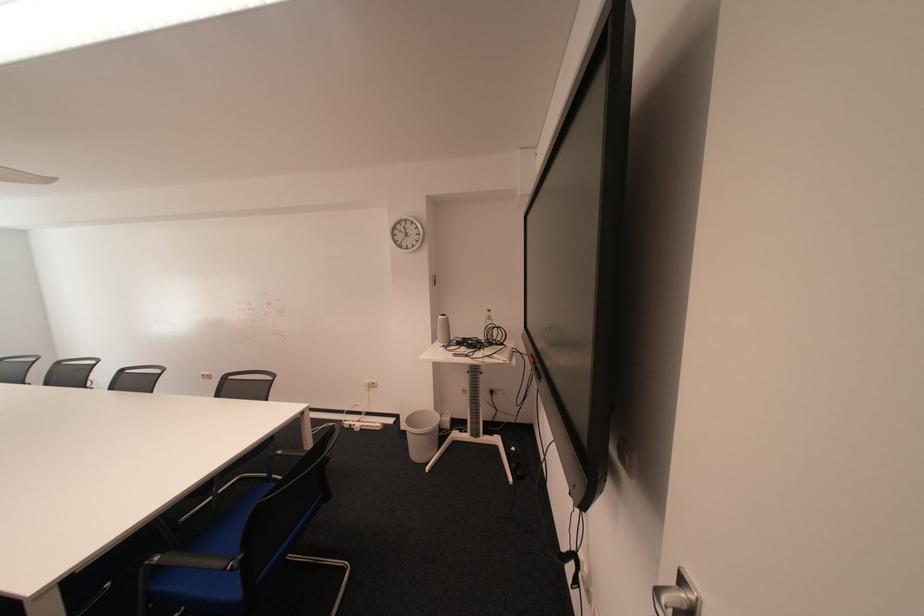
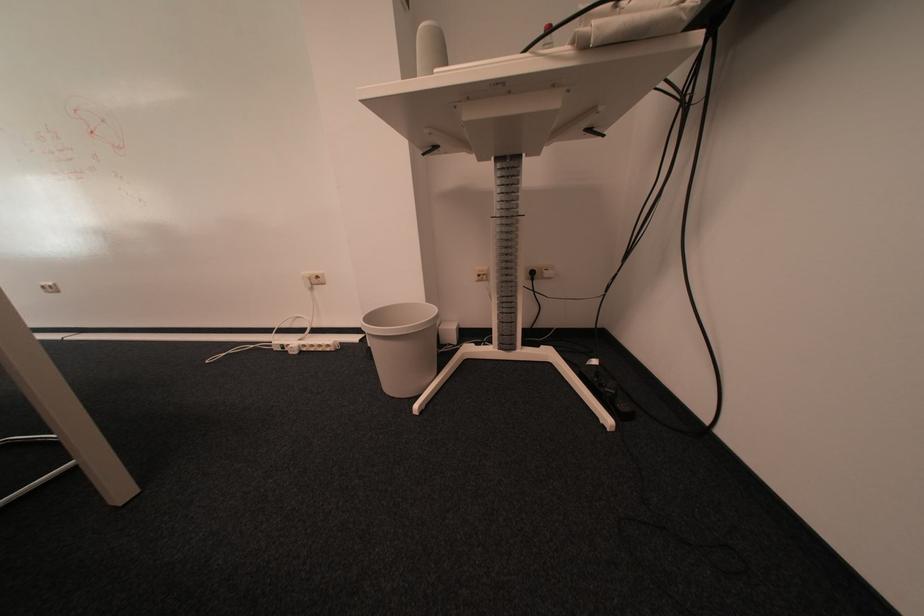
Question: The images are taken continuously from a first-person perspective. In which direction are you moving?

Choices:
 (A) Left
 (B) Right
 (C) Forward
 (D) Backward

Answer: (C)